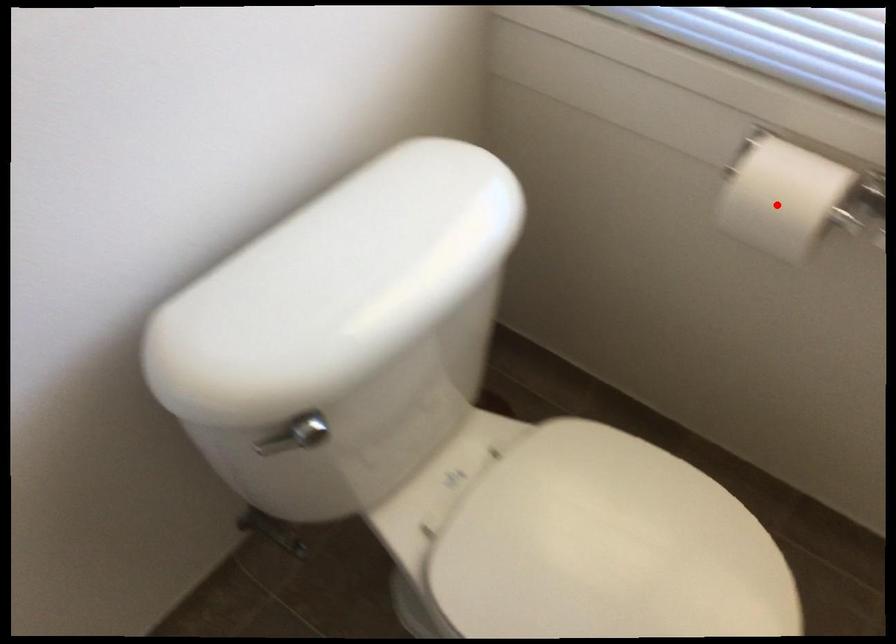
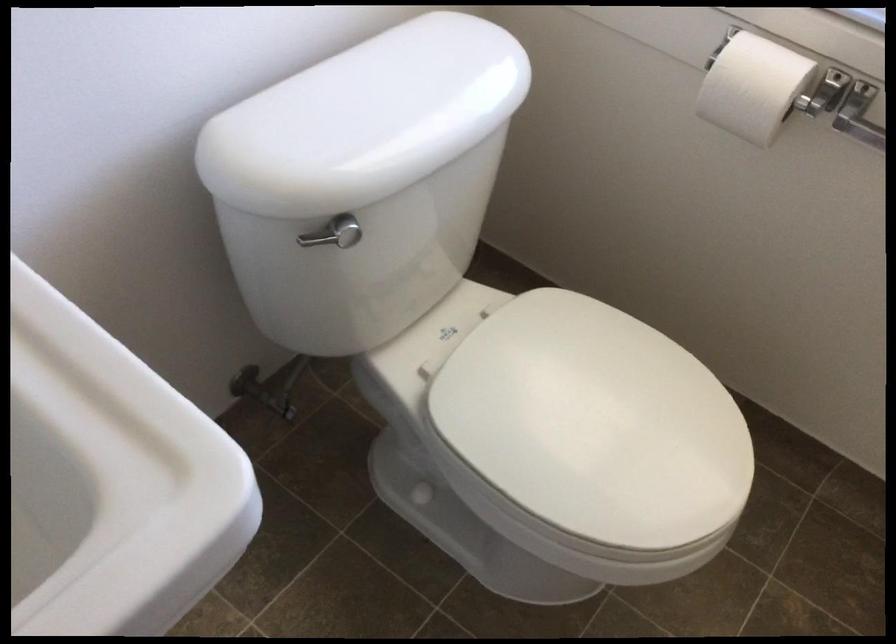
Question: I am providing you with two images of the same scene from different viewpoints. In image1, a red point is highlighted. Considering the same 3D point in image2, which of the following is correct?

Choices:
 (A) It is closer
 (B) It is farther

Answer: (B)